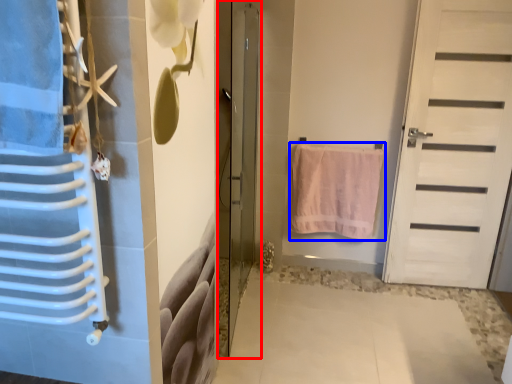
Question: Among these objects, which one is farthest to the camera, door (highlighted by a red box) or towel (highlighted by a blue box)?

Choices:
 (A) door
 (B) towel

Answer: (B)